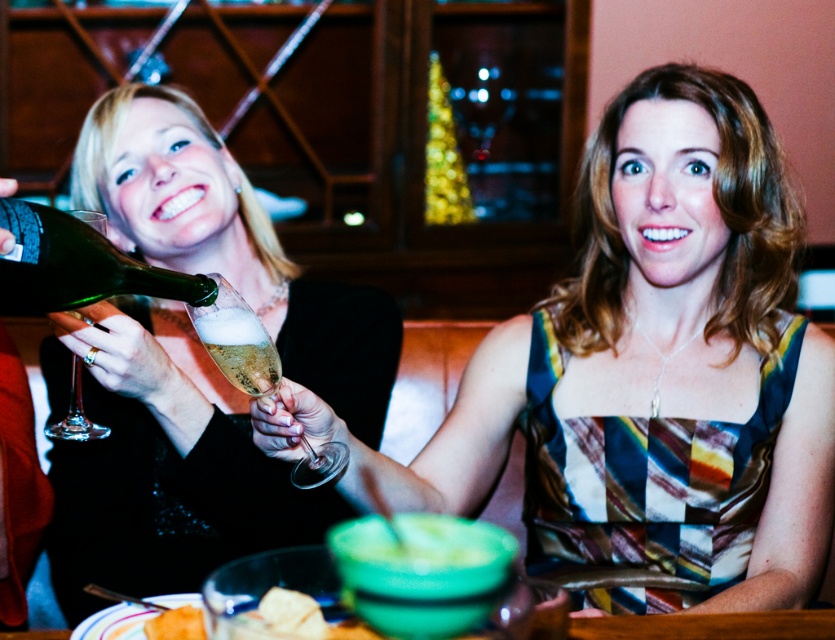
Question: Which point is farther from the camera taking this photo?

Choices:
 (A) (3, 305)
 (B) (707, 164)
 (C) (149, 621)

Answer: (B)

Question: Which point appears farthest from the camera in this image?

Choices:
 (A) (577, 483)
 (B) (163, 624)
 (C) (319, 484)
 (D) (79, 400)

Answer: (A)

Question: Is multicolored fabric dress at center bigger than golden crumbly bread at lower left?

Choices:
 (A) no
 (B) yes

Answer: (B)

Question: Is green glass at left above golden crumbly bread at lower left?

Choices:
 (A) no
 (B) yes

Answer: (B)

Question: Which object is farther from the camera taking this photo?

Choices:
 (A) green glass at left
 (B) green glass bottle at left

Answer: (A)

Question: Is multicolored fabric dress at center above green glass at left?

Choices:
 (A) yes
 (B) no

Answer: (B)